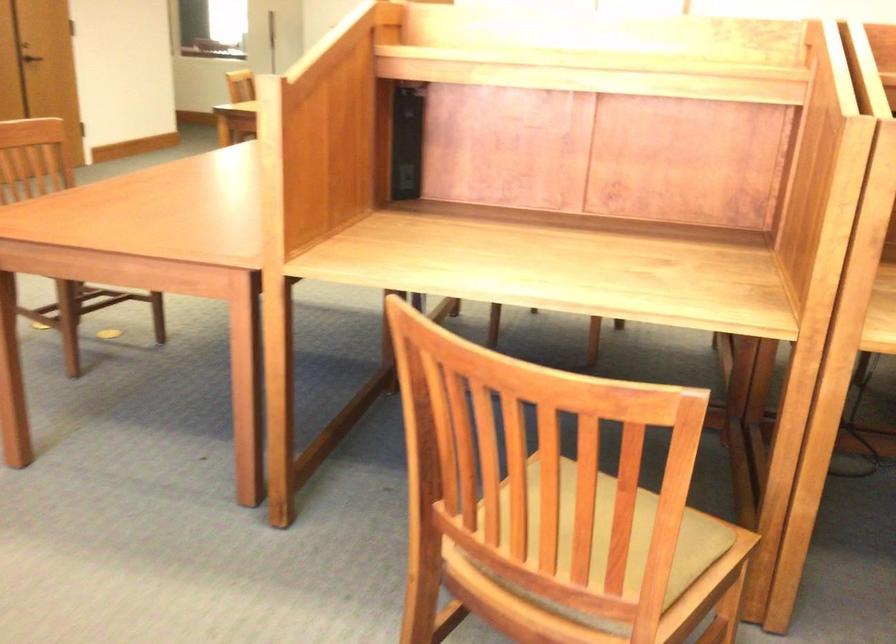
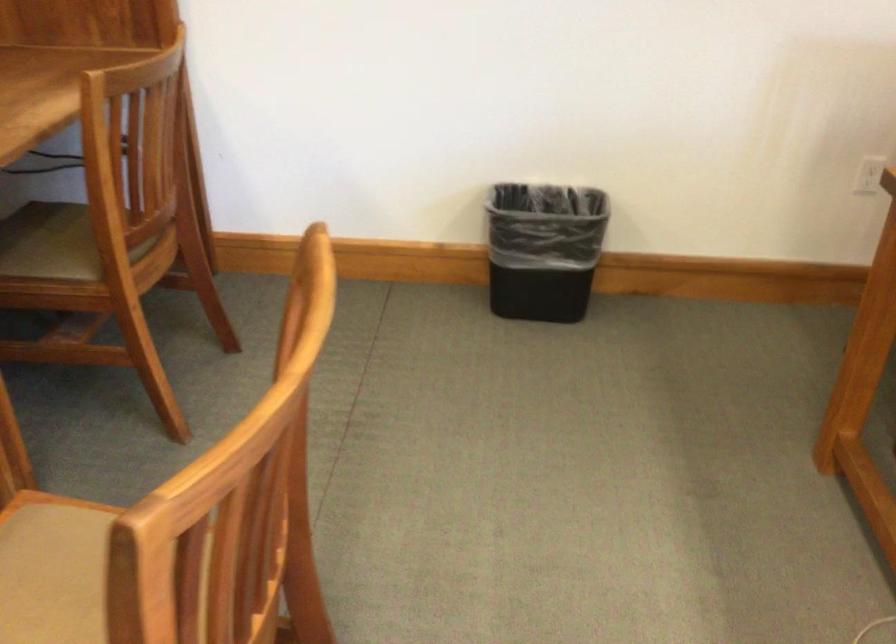
The images are taken continuously from a first-person perspective. In which direction is your viewpoint rotating?

The camera rotated toward right-down.